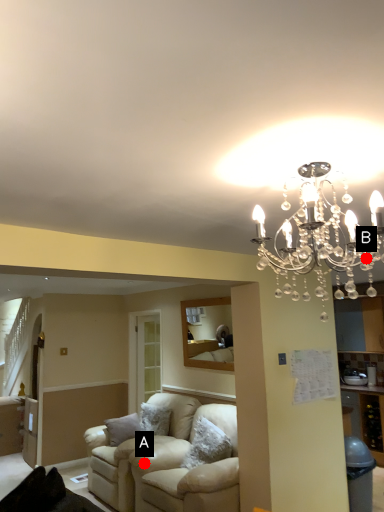
Question: Two points are circled on the image, labeled by A and B beside each circle. Among these points, which one is nearest to the camera?

Choices:
 (A) A is closer
 (B) B is closer

Answer: (B)